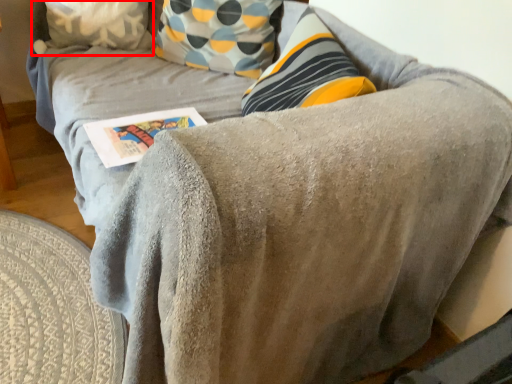
Question: From the image's perspective, considering the relative positions of pillow (annotated by the red box) and paperback book in the image provided, where is pillow (annotated by the red box) located with respect to the staircase?

Choices:
 (A) below
 (B) above

Answer: (B)